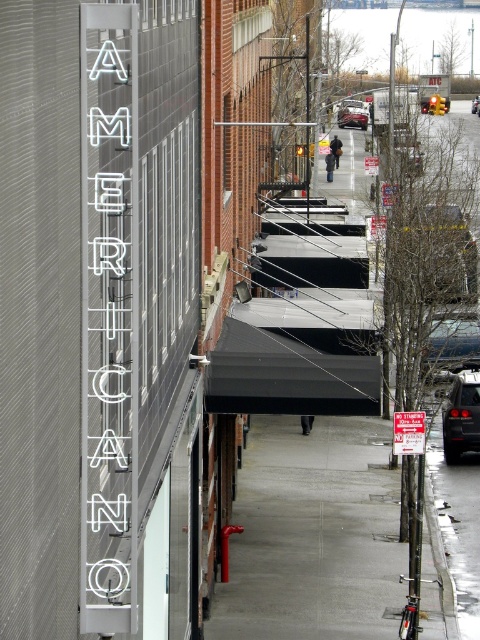
In the scene shown: Does gray concrete sidewalk at center have a smaller size compared to shiny black sedan at center?

No.

Is gray concrete sidewalk at center wider than shiny black sedan at center?

Yes, gray concrete sidewalk at center is wider than shiny black sedan at center.

The image size is (480, 640). What do you see at coordinates (313, 536) in the screenshot?
I see `gray concrete sidewalk at center` at bounding box center [313, 536].

Image resolution: width=480 pixels, height=640 pixels. I want to click on gray concrete sidewalk at center, so click(x=313, y=536).

Between point (292, 621) and point (448, 401), which one is positioned in front?

Positioned in front is point (292, 621).

Can you confirm if gray concrete sidewalk at center is wider than shiny black car at center right?

Yes.

Identify the location of gray concrete sidewalk at center. (313, 536).

Which is more to the right, gray concrete sidewalk at center or red plastic sign at center?

red plastic sign at center

Based on the photo, does gray concrete sidewalk at center appear over red plastic sign at center?

No.

Based on the photo, measure the distance between gray concrete sidewalk at center and camera.

They are 14.89 meters apart.

This screenshot has height=640, width=480. I want to click on gray concrete sidewalk at center, so click(313, 536).